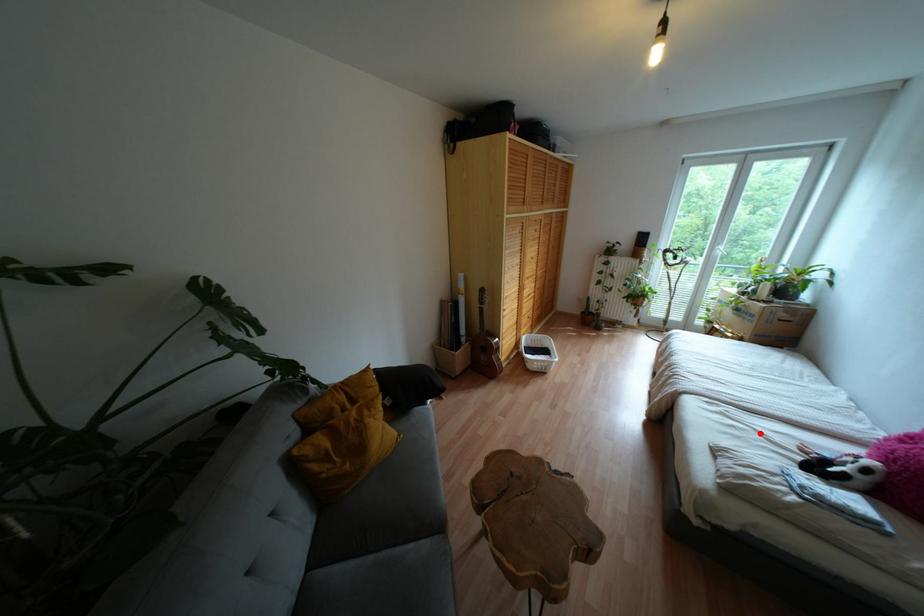
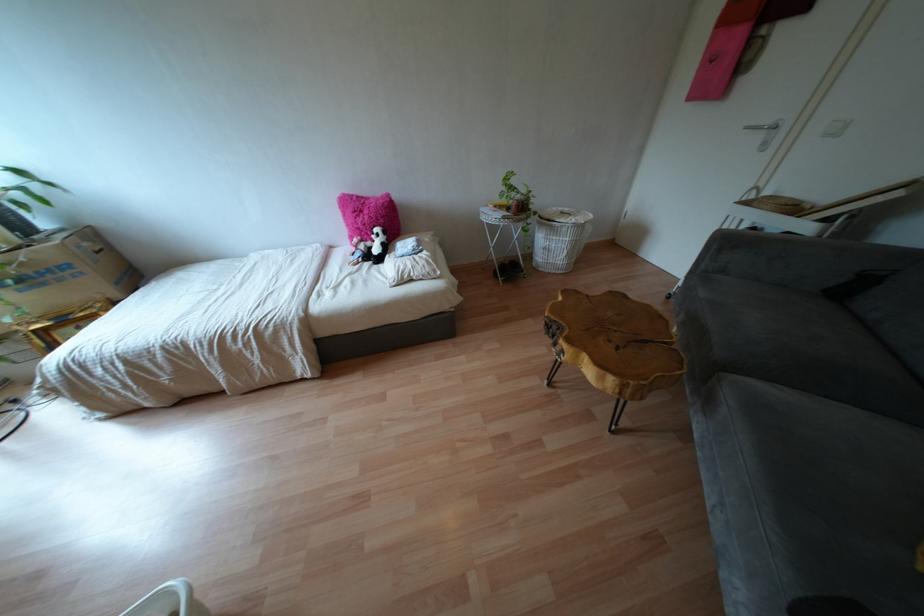
Where in the second image is the point corresponding to the highlighted location from the first image?

(349, 274)